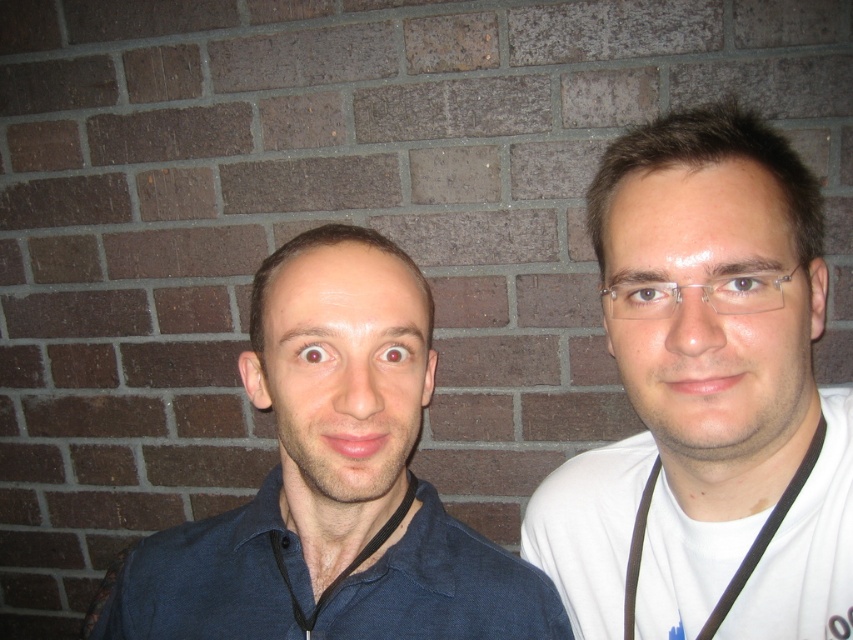
You are a photographer setting up a photo shoot. You have two models wearing white matte shirts. The first model is wearing a white matte shirt at right, and the second model is wearing a white matte polo shirt at right. Which model should you choose if you need a shirt that takes up more visual space in the photo?

The white matte shirt at right is larger in size than the white matte polo shirt at right, so you should choose the model wearing the white matte shirt at right for the photo shoot to achieve the desired visual space.

You are a photographer setting up a photo shoot. You need to place a 15cm tall prop between the matte blue shirt at center and the white matte polo shirt at right. Based on their positions, where should you place the prop so it sits between them?

The matte blue shirt at center is below the white matte polo shirt at right, so you should place the prop between them vertically. Position it just above the matte blue shirt at center and below the white matte polo shirt at right to ensure it sits between them.